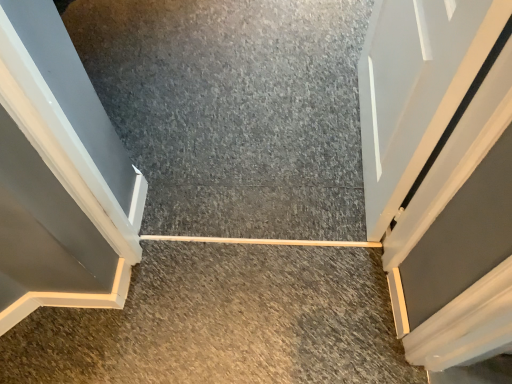
Question: Is smooth concrete at center, the 1th concrete positioned from the top, at the right side of smooth concrete at center, acting as the 1th concrete starting from the bottom?

Choices:
 (A) yes
 (B) no

Answer: (A)

Question: From the image's perspective, is smooth concrete at center, the 1th concrete positioned from the top, on top of smooth concrete at center, acting as the 1th concrete starting from the bottom?

Choices:
 (A) yes
 (B) no

Answer: (A)

Question: Can you confirm if smooth concrete at center, the 2th concrete viewed from the front, is taller than smooth concrete at center, acting as the 1th concrete starting from the bottom?

Choices:
 (A) yes
 (B) no

Answer: (B)

Question: Does smooth concrete at center, acting as the first concrete starting from the back, appear on the left side of smooth concrete at center, which is the 2th concrete from top to bottom?

Choices:
 (A) yes
 (B) no

Answer: (B)

Question: Is smooth concrete at center, acting as the first concrete starting from the back, far from smooth concrete at center, which is the 2th concrete from top to bottom?

Choices:
 (A) no
 (B) yes

Answer: (A)

Question: From a real-world perspective, relative to white glossy door at upper right, is smooth concrete at center, acting as the 1th concrete starting from the bottom, vertically above or below?

Choices:
 (A) above
 (B) below

Answer: (B)

Question: From the image's perspective, is smooth concrete at center, the second concrete positioned from the back, located above or below white glossy door at upper right?

Choices:
 (A) above
 (B) below

Answer: (B)

Question: In terms of width, does smooth concrete at center, the 1th concrete positioned from the front, look wider or thinner when compared to white glossy door at upper right?

Choices:
 (A) thin
 (B) wide

Answer: (B)

Question: Based on their sizes in the image, would you say smooth concrete at center, the second concrete positioned from the back, is bigger or smaller than white glossy door at upper right?

Choices:
 (A) small
 (B) big

Answer: (A)

Question: Would you say smooth concrete at center, acting as the first concrete starting from the back, is inside or outside white glossy door at upper right?

Choices:
 (A) outside
 (B) inside

Answer: (A)

Question: Relative to white glossy door at upper right, is smooth concrete at center, the 1th concrete positioned from the top, in front or behind?

Choices:
 (A) front
 (B) behind

Answer: (B)

Question: From a real-world perspective, is smooth concrete at center, the 2th concrete viewed from the front, positioned above or below white glossy door at upper right?

Choices:
 (A) above
 (B) below

Answer: (B)

Question: Visually, is smooth concrete at center, acting as the first concrete starting from the back, positioned to the left or to the right of white glossy door at upper right?

Choices:
 (A) right
 (B) left

Answer: (B)

Question: From the image's perspective, relative to smooth concrete at center, the second concrete positioned from the bottom, is smooth concrete at center, which is the 2th concrete from top to bottom, above or below?

Choices:
 (A) below
 (B) above

Answer: (A)

Question: Looking at their shapes, would you say smooth concrete at center, the 1th concrete positioned from the front, is wider or thinner than smooth concrete at center, the second concrete positioned from the bottom?

Choices:
 (A) wide
 (B) thin

Answer: (B)